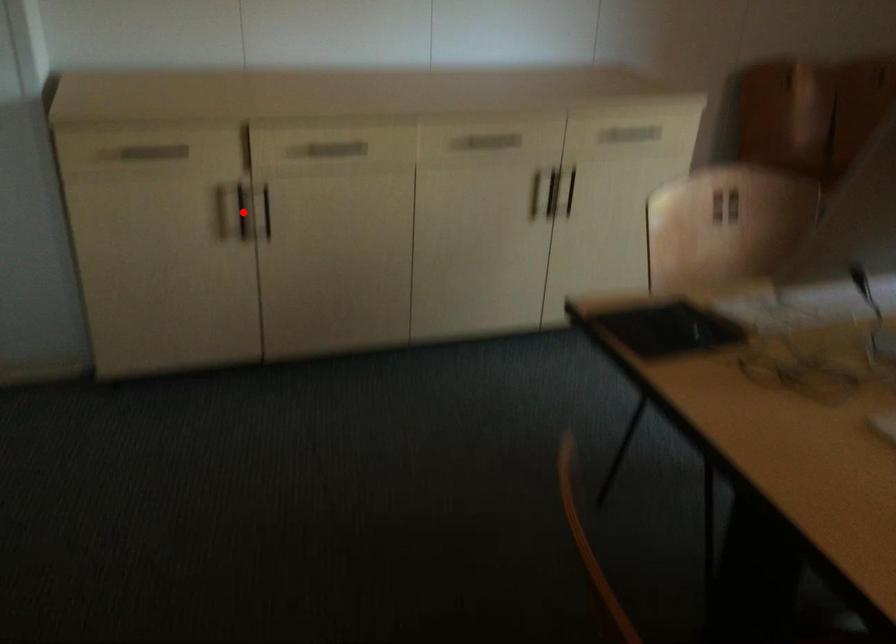
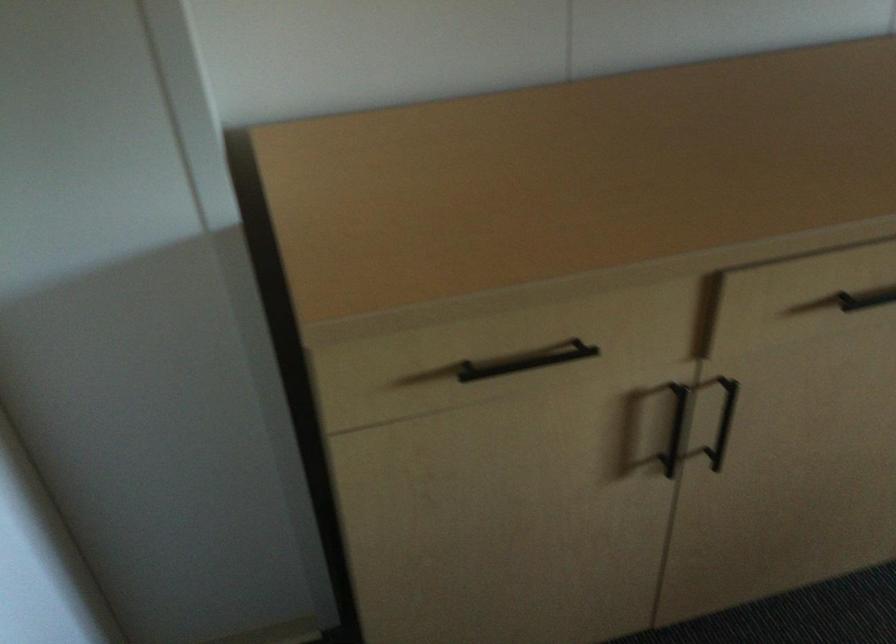
Question: I am providing you with two images of the same scene from different viewpoints. Image1 has a red point marked. In image2, the corresponding 3D location appears at what relative position? Reply with the corresponding letter.

Choices:
 (A) Closer
 (B) Farther

Answer: (A)